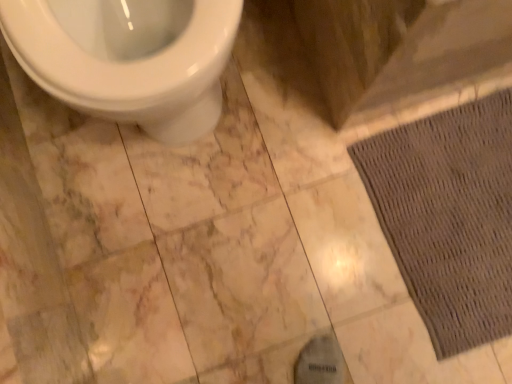
Identify the location of brown textured mat at lower right. (449, 216).

What do you see at coordinates (449, 216) in the screenshot?
I see `brown textured mat at lower right` at bounding box center [449, 216].

In order to click on white glossy toilet at upper left in this screenshot , I will do `click(129, 58)`.

This screenshot has height=384, width=512. Describe the element at coordinates (129, 58) in the screenshot. I see `white glossy toilet at upper left` at that location.

You are a GUI agent. You are given a task and a screenshot of the screen. Output one action in this format:
    pyautogui.click(x=<x>, y=<y>)
    Task: Click on the brown textured mat at lower right
    Image resolution: width=512 pixels, height=384 pixels.
    Given the screenshot: What is the action you would take?
    pyautogui.click(x=449, y=216)

Is white glossy toilet at upper left at the left side of brown textured mat at lower right?

Correct, you'll find white glossy toilet at upper left to the left of brown textured mat at lower right.

Which is behind, white glossy toilet at upper left or brown textured mat at lower right?

Positioned behind is brown textured mat at lower right.

Considering the points (227, 23) and (411, 269), which point is in front, point (227, 23) or point (411, 269)?

The point (227, 23) is closer.

From the image's perspective, is white glossy toilet at upper left above brown textured mat at lower right?

Yes, from the image's perspective, white glossy toilet at upper left is above brown textured mat at lower right.

From a real-world perspective, is white glossy toilet at upper left physically located above or below brown textured mat at lower right?

white glossy toilet at upper left is situated higher than brown textured mat at lower right in the real world.

Which of these two, white glossy toilet at upper left or brown textured mat at lower right, is thinner?

white glossy toilet at upper left is thinner.

Based on the photo, does white glossy toilet at upper left have a lesser height compared to brown textured mat at lower right?

No, white glossy toilet at upper left is not shorter than brown textured mat at lower right.

Considering the relative sizes of white glossy toilet at upper left and brown textured mat at lower right in the image provided, is white glossy toilet at upper left bigger than brown textured mat at lower right?

Yes, white glossy toilet at upper left is bigger than brown textured mat at lower right.

Is brown textured mat at lower right surrounded by white glossy toilet at upper left?

No.

Is white glossy toilet at upper left not near brown textured mat at lower right?

No, white glossy toilet at upper left is not far from brown textured mat at lower right.

Is white glossy toilet at upper left positioned with its back to brown textured mat at lower right?

No, white glossy toilet at upper left is not facing the opposite direction of brown textured mat at lower right.

Can you tell me how much white glossy toilet at upper left and brown textured mat at lower right differ in facing direction?

The angular difference between white glossy toilet at upper left and brown textured mat at lower right is 0.781 degrees.

Locate an element on the screen. The image size is (512, 384). toilet above the brown textured mat at lower right (from a real-world perspective) is located at coordinates (129, 58).

Considering the positions of objects brown textured mat at lower right and white glossy toilet at upper left in the image provided, who is more to the right, brown textured mat at lower right or white glossy toilet at upper left?

brown textured mat at lower right is more to the right.

Which object is further away from the camera, brown textured mat at lower right or white glossy toilet at upper left?

brown textured mat at lower right is further away from the camera.

Between point (498, 313) and point (195, 39), which one is positioned in front?

Point (195, 39)

From the image's perspective, is brown textured mat at lower right located above white glossy toilet at upper left?

No, from the image's perspective, brown textured mat at lower right is not above white glossy toilet at upper left.

From a real-world perspective, does brown textured mat at lower right sit lower than white glossy toilet at upper left?

Correct, in the physical world, brown textured mat at lower right is lower than white glossy toilet at upper left.

Between brown textured mat at lower right and white glossy toilet at upper left, which one has larger width?

brown textured mat at lower right is wider.

Does brown textured mat at lower right have a lesser height compared to white glossy toilet at upper left?

Yes, brown textured mat at lower right is shorter than white glossy toilet at upper left.

Looking at the image, does brown textured mat at lower right seem bigger or smaller compared to white glossy toilet at upper left?

brown textured mat at lower right is smaller than white glossy toilet at upper left.

Is brown textured mat at lower right not within white glossy toilet at upper left?

Absolutely, brown textured mat at lower right is external to white glossy toilet at upper left.

Is brown textured mat at lower right not close to white glossy toilet at upper left?

brown textured mat at lower right is near white glossy toilet at upper left, not far away.

Is brown textured mat at lower right looking in the opposite direction of white glossy toilet at upper left?

No, white glossy toilet at upper left is not at the back of brown textured mat at lower right.

What's the angular difference between brown textured mat at lower right and white glossy toilet at upper left's facing directions?

brown textured mat at lower right and white glossy toilet at upper left are facing 0.781 degrees away from each other.

Where is `toilet above the brown textured mat at lower right (from a real-world perspective)`? toilet above the brown textured mat at lower right (from a real-world perspective) is located at coordinates (129, 58).

You are a GUI agent. You are given a task and a screenshot of the screen. Output one action in this format:
    pyautogui.click(x=<x>, y=<y>)
    Task: Click on the toilet on the left of brown textured mat at lower right
    Image resolution: width=512 pixels, height=384 pixels.
    Given the screenshot: What is the action you would take?
    pyautogui.click(x=129, y=58)

The width and height of the screenshot is (512, 384). Find the location of `doormat that is below the white glossy toilet at upper left (from the image's perspective)`. doormat that is below the white glossy toilet at upper left (from the image's perspective) is located at coordinates (449, 216).